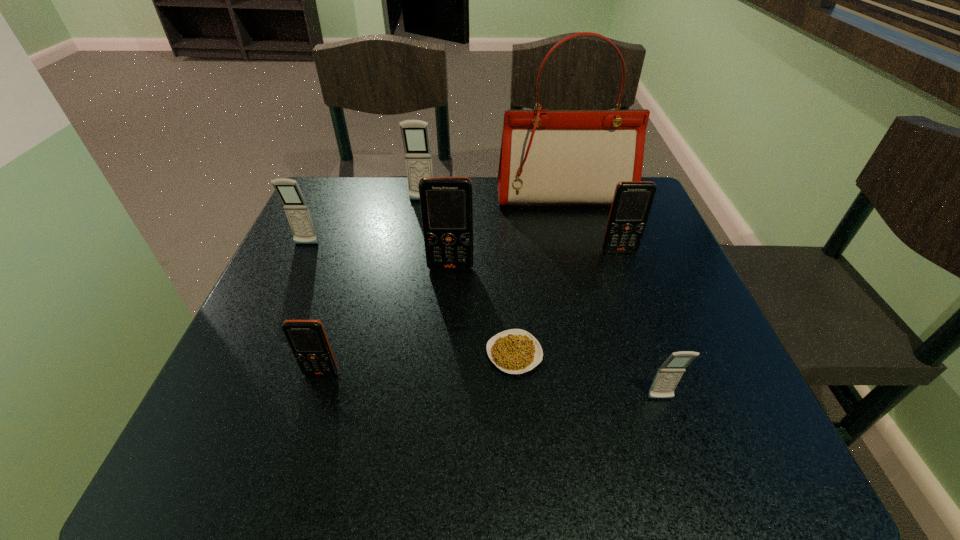
Where is `free point between the pink handbag and the legume`? free point between the pink handbag and the legume is located at coordinates (540, 275).

Where is `unoccupied position between the smallest gray cellular telephone and the tallest object`? The width and height of the screenshot is (960, 540). unoccupied position between the smallest gray cellular telephone and the tallest object is located at coordinates (612, 298).

Where is `free space between the nearest cellular telephone and the tallest object`? The height and width of the screenshot is (540, 960). free space between the nearest cellular telephone and the tallest object is located at coordinates (612, 298).

Find the location of a particular element. This screenshot has width=960, height=540. vacant space that's between the legume and the nearest object is located at coordinates (588, 376).

Identify the location of the seventh closest object relative to the legume. This screenshot has width=960, height=540. (297, 211).

Locate an element on the screen. The height and width of the screenshot is (540, 960). the closest object to the third object from left to right is located at coordinates (548, 157).

Select which cellular telephone is the second closest to the rightmost orange cellular telephone. Please provide its 2D coordinates. Your answer should be formatted as a tuple, i.e. [(x, y)], where the tuple contains the x and y coordinates of a point satisfying the conditions above.

[(669, 374)]

You are a GUI agent. You are given a task and a screenshot of the screen. Output one action in this format:
    pyautogui.click(x=<x>, y=<y>)
    Task: Click on the cellular telephone that is the second closest one to the third farthest object
    The height and width of the screenshot is (540, 960).
    Given the screenshot: What is the action you would take?
    pyautogui.click(x=446, y=203)

Where is `gray cellular telephone that can be found as the third closest to the legume`? The height and width of the screenshot is (540, 960). gray cellular telephone that can be found as the third closest to the legume is located at coordinates (297, 211).

Identify which gray cellular telephone is located as the second nearest to the nearest cellular telephone. Please provide its 2D coordinates. Your answer should be formatted as a tuple, i.e. [(x, y)], where the tuple contains the x and y coordinates of a point satisfying the conditions above.

[(297, 211)]